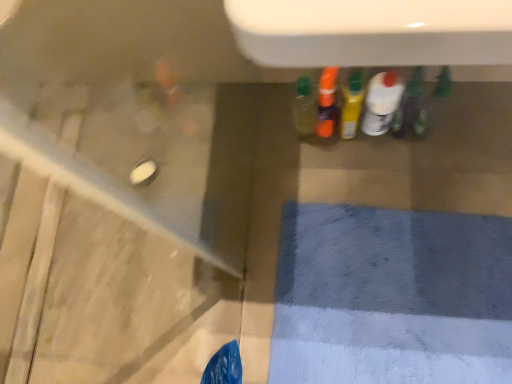
I want to click on vacant area to the left of green matte bottle at center, marked as the 1th bottle in a right-to-left arrangement, so click(x=358, y=167).